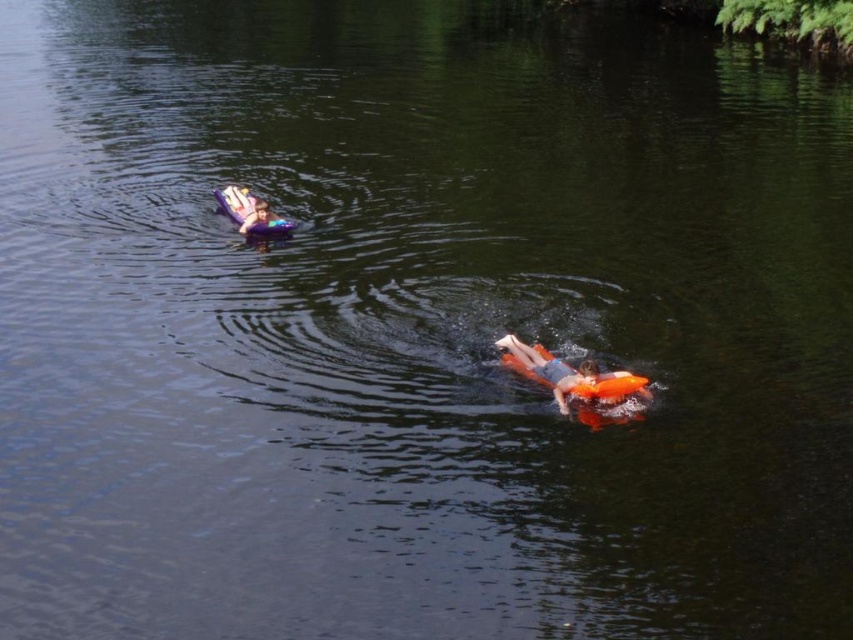
Between orange foam at center and purple foam kayak at upper left, which one is positioned higher?

purple foam kayak at upper left is above.

Does orange foam at center have a larger size compared to purple foam kayak at upper left?

Correct, orange foam at center is larger in size than purple foam kayak at upper left.

Image resolution: width=853 pixels, height=640 pixels. Describe the element at coordinates (570, 376) in the screenshot. I see `orange foam at center` at that location.

Identify the location of orange foam at center. Image resolution: width=853 pixels, height=640 pixels. (570, 376).

Does orange foam at center appear under orange life vest at upper center?

Yes, orange foam at center is below orange life vest at upper center.

Which is in front, point (610, 380) or point (267, 221)?

Point (610, 380)

You are a GUI agent. You are given a task and a screenshot of the screen. Output one action in this format:
    pyautogui.click(x=<x>, y=<y>)
    Task: Click on the orange foam at center
    The image size is (853, 640).
    Given the screenshot: What is the action you would take?
    pyautogui.click(x=570, y=376)

Is purple foam kayak at upper left behind orange life vest at upper center?

Yes, it is.

Which is behind, point (242, 225) or point (271, 214)?

The point (271, 214) is more distant.

Locate an element on the screen. The width and height of the screenshot is (853, 640). purple foam kayak at upper left is located at coordinates (250, 212).

I want to click on purple foam kayak at upper left, so click(250, 212).